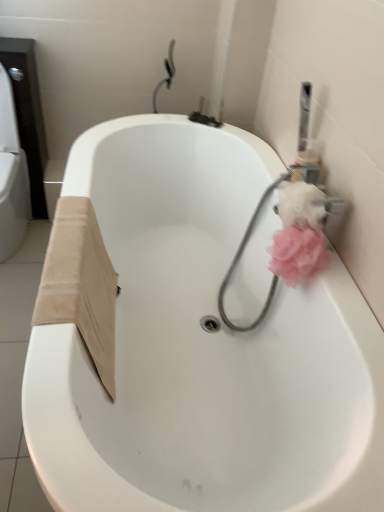
Question: Relative to white glossy bathtub at center, is pink fabric bath puff at right in front or behind?

Choices:
 (A) behind
 (B) front

Answer: (A)

Question: Visually, is pink fabric bath puff at right positioned to the left or to the right of white glossy bathtub at center?

Choices:
 (A) left
 (B) right

Answer: (B)

Question: Estimate the real-world distances between objects in this image. Which object is farther from the pink fluffy loofah at right?

Choices:
 (A) pink fabric bath puff at right
 (B) white glossy bathtub at center
 (C) pink fluffy toilet paper at upper right

Answer: (B)

Question: Which object is the closest to the pink fluffy toilet paper at upper right?

Choices:
 (A) white glossy bathtub at center
 (B) pink fabric bath puff at right
 (C) pink fluffy loofah at right

Answer: (C)